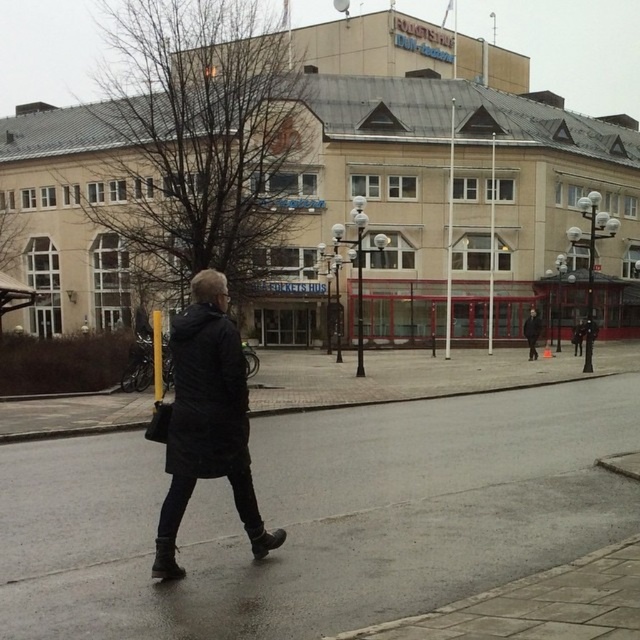
Can you confirm if dark gray asphalt at center is taller than black matte jacket at center?

No.

Who is lower down, dark gray asphalt at center or black matte jacket at center?

dark gray asphalt at center is below.

Does point (484, 531) lie behind point (528, 324)?

No, it is in front of (528, 324).

Where is `dark gray asphalt at center`? This screenshot has width=640, height=640. dark gray asphalt at center is located at coordinates (324, 512).

Is black matte coat at center to the left of black matte jacket at center from the viewer's perspective?

Yes, black matte coat at center is to the left of black matte jacket at center.

Which is behind, point (196, 337) or point (529, 330)?

Point (529, 330)

What do you see at coordinates (208, 420) in the screenshot? The image size is (640, 640). I see `black matte coat at center` at bounding box center [208, 420].

Locate an element on the screen. black matte coat at center is located at coordinates (208, 420).

Is point (61, 630) closer to camera compared to point (214, 440)?

Yes.

Is dark gray asphalt at center thinner than black matte coat at center?

In fact, dark gray asphalt at center might be wider than black matte coat at center.

Locate an element on the screen. dark gray asphalt at center is located at coordinates (324, 512).